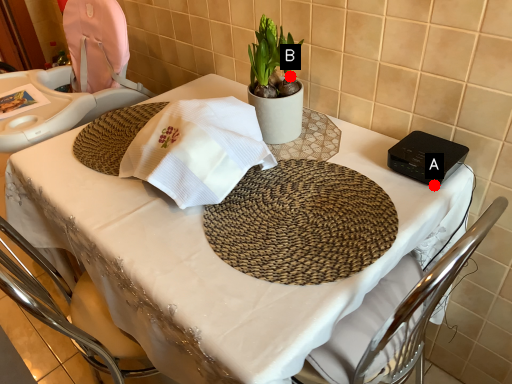
Question: Two points are circled on the image, labeled by A and B beside each circle. Among these points, which one is nearest to the camera?

Choices:
 (A) A is closer
 (B) B is closer

Answer: (A)